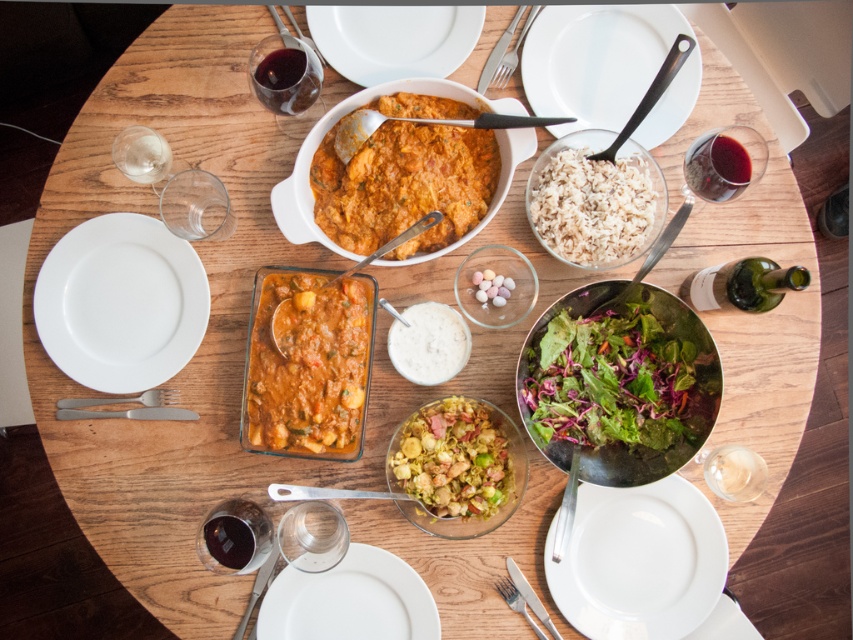
Which of these two, white matte rice at center right or white matte plate at lower center, stands shorter?

white matte plate at lower center

Between white matte rice at center right and white matte plate at lower center, which one is positioned higher?

white matte rice at center right

Is point (575, 204) in front of point (344, 560)?

Yes, point (575, 204) is in front of point (344, 560).

Image resolution: width=853 pixels, height=640 pixels. I want to click on white matte rice at center right, so click(595, 205).

Between translucent glass wine at upper right and translucent glass wine at upper left, which one is positioned higher?

translucent glass wine at upper left

Can you confirm if translucent glass wine at upper right is positioned to the left of translucent glass wine at upper left?

No, translucent glass wine at upper right is not to the left of translucent glass wine at upper left.

Is point (699, 182) more distant than point (258, 68)?

Yes, it is behind point (258, 68).

Locate an element on the screen. The height and width of the screenshot is (640, 853). translucent glass wine at upper right is located at coordinates (706, 184).

Is point (47, 291) farther from camera compared to point (332, 56)?

No, it is in front of (332, 56).

Does white ceramic plate at lower left have a lesser width compared to white ceramic plate at upper center?

Yes.

Locate an element on the screen. Image resolution: width=853 pixels, height=640 pixels. white ceramic plate at lower left is located at coordinates (120, 301).

This screenshot has height=640, width=853. Identify the location of white ceramic plate at lower left. (120, 301).